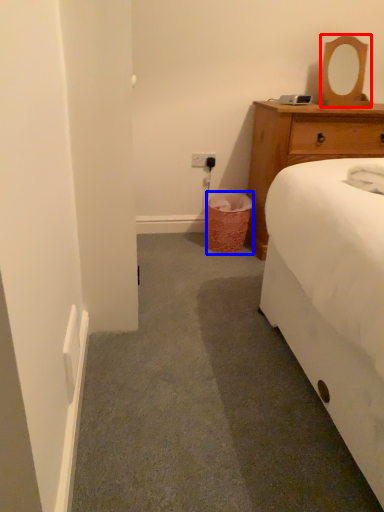
Question: Among these objects, which one is farthest to the camera, mirror (highlighted by a red box) or trash bin/can (highlighted by a blue box)?

Choices:
 (A) mirror
 (B) trash bin/can

Answer: (B)